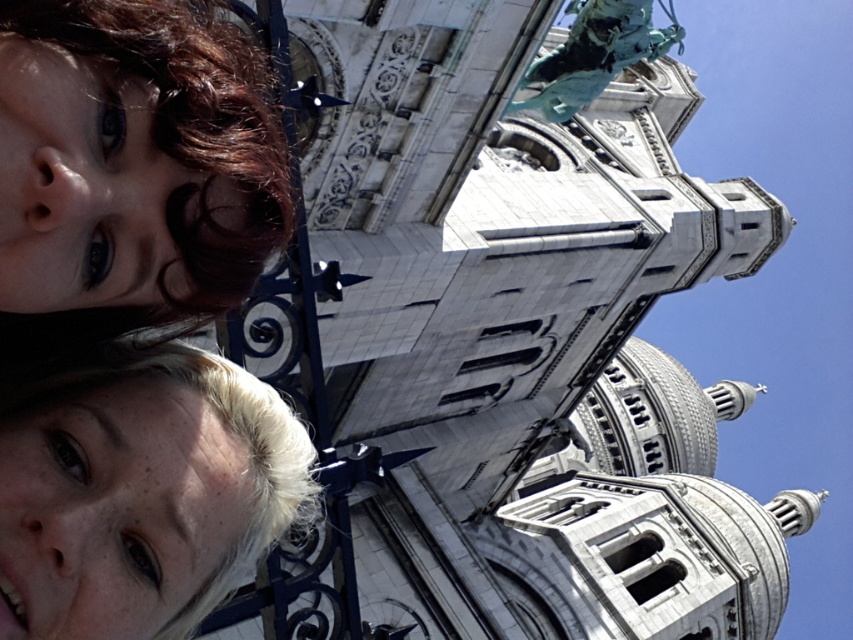
Between matte brown hair at upper left and blonde hair at lower left, which one is positioned higher?

Positioned higher is matte brown hair at upper left.

Does point (32, 88) lie behind point (213, 381)?

No, (32, 88) is in front of (213, 381).

Is point (258, 205) positioned after point (190, 552)?

Yes, point (258, 205) is farther from viewer.

Locate an element on the screen. This screenshot has width=853, height=640. matte brown hair at upper left is located at coordinates (131, 168).

Can you confirm if white stone tower at upper center is positioned below matte brown hair at upper left?

Indeed, white stone tower at upper center is positioned under matte brown hair at upper left.

Does point (297, 84) lie in front of point (247, 92)?

No, (297, 84) is behind (247, 92).

Where is `white stone tower at upper center`? This screenshot has height=640, width=853. white stone tower at upper center is located at coordinates (498, 344).

Between white stone tower at upper center and blonde hair at lower left, which one is positioned lower?

Positioned lower is white stone tower at upper center.

Which of these two, white stone tower at upper center or blonde hair at lower left, stands shorter?

Standing shorter between the two is blonde hair at lower left.

Locate an element on the screen. The width and height of the screenshot is (853, 640). white stone tower at upper center is located at coordinates (498, 344).